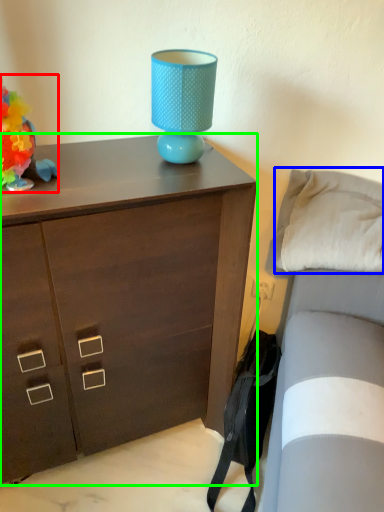
Question: Based on their relative distances, which object is farther from toy (highlighted by a red box)? Choose from pillow (highlighted by a blue box) and chest of drawers (highlighted by a green box).

Choices:
 (A) pillow
 (B) chest of drawers

Answer: (A)